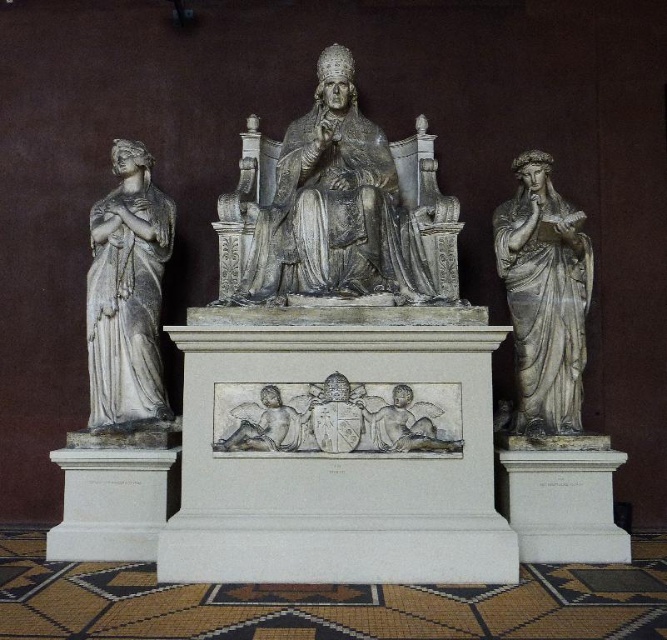
Question: Considering the relative positions of matte silver statue at center and white marble statue at right in the image provided, where is matte silver statue at center located with respect to white marble statue at right?

Choices:
 (A) above
 (B) below

Answer: (A)

Question: Among these objects, which one is nearest to the camera?

Choices:
 (A) white stone coat of arms at center
 (B) white marble cherub at center

Answer: (B)

Question: Is white marble statue at left to the right of white stone coat of arms at center from the viewer's perspective?

Choices:
 (A) no
 (B) yes

Answer: (A)

Question: Is matte silver statue at center in front of white marble cherub at center?

Choices:
 (A) yes
 (B) no

Answer: (B)

Question: Which point appears farthest from the camera in this image?

Choices:
 (A) coord(354,424)
 (B) coord(231,449)

Answer: (A)

Question: Which of these objects is positioned farthest from the white marble statue at right?

Choices:
 (A) white marble statue at left
 (B) matte silver statue at center
 (C) white stone coat of arms at center
 (D) white marble cherub at center

Answer: (A)